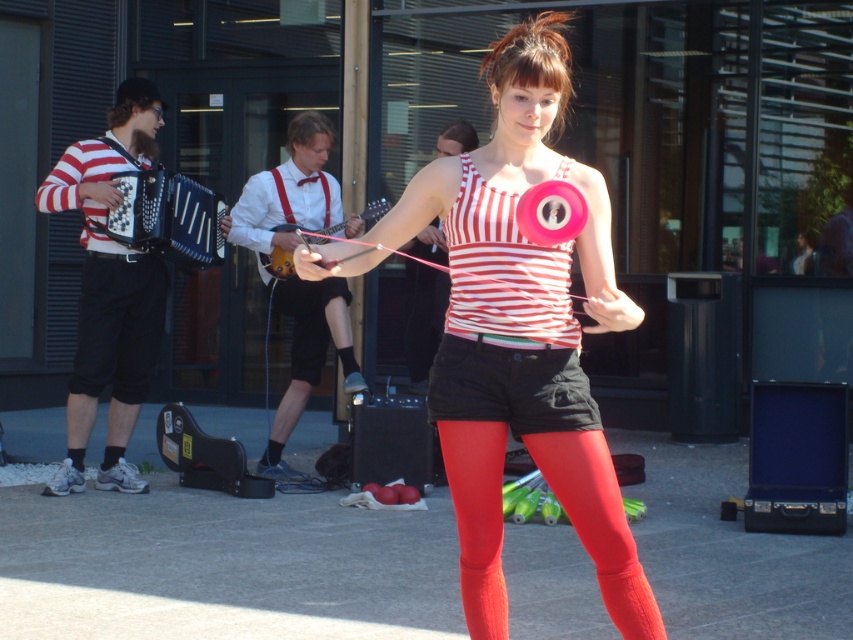
Question: Which object is closer to the camera taking this photo?

Choices:
 (A) striped fabric accordion at left
 (B) black matte accordion at left

Answer: (A)

Question: Can you confirm if striped fabric accordion at left is positioned to the left of satin red leggings at center?

Choices:
 (A) yes
 (B) no

Answer: (A)

Question: Which of these objects is positioned closest to the matte white guitar at center?

Choices:
 (A) satin red leggings at center
 (B) matte striped tank top at center

Answer: (B)

Question: Estimate the real-world distances between objects in this image. Which object is farther from the black matte accordion at left?

Choices:
 (A) matte striped tank top at center
 (B) striped fabric accordion at left
 (C) matte white guitar at center
 (D) satin red leggings at center

Answer: (D)

Question: Does satin red leggings at center have a larger size compared to black matte accordion at left?

Choices:
 (A) no
 (B) yes

Answer: (A)

Question: From the image, what is the correct spatial relationship of satin red leggings at center in relation to matte white guitar at center?

Choices:
 (A) left
 (B) right

Answer: (B)